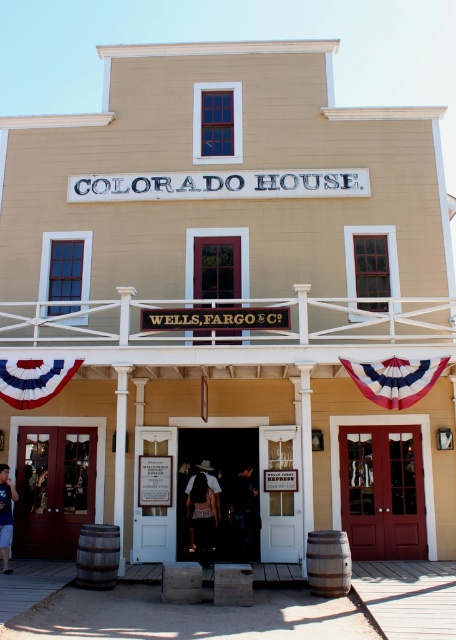
Does matte brown door at center have a greater width compared to wooden door at center?

Correct, the width of matte brown door at center exceeds that of wooden door at center.

Who is lower down, matte brown door at center or wooden door at center?

matte brown door at center is lower down.

Find the location of a particular element. The height and width of the screenshot is (640, 456). matte brown door at center is located at coordinates (219, 493).

Does matte wood door at center have a lesser width compared to wooden door at center?

Incorrect, matte wood door at center's width is not less than wooden door at center's.

What do you see at coordinates (383, 492) in the screenshot? The height and width of the screenshot is (640, 456). I see `matte wood door at center` at bounding box center [383, 492].

Where is `matte wood door at center`? This screenshot has height=640, width=456. matte wood door at center is located at coordinates (383, 492).

Who is more forward, (405, 404) or (14, 397)?

Positioned in front is point (405, 404).

Identify the location of red-white-blue fabric banner at center. (395, 380).